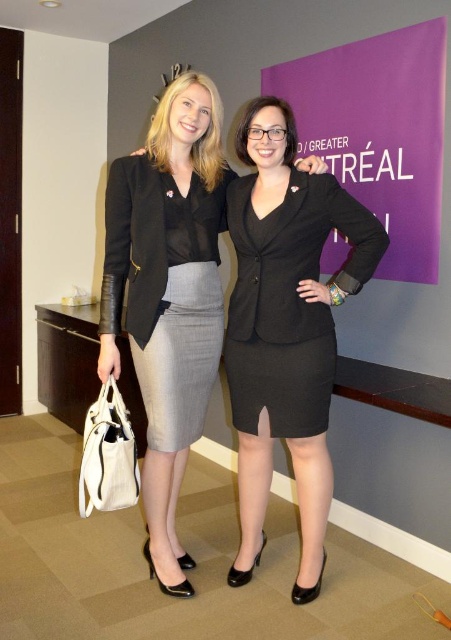
Where is `matte black blazer at center`? This screenshot has height=640, width=451. matte black blazer at center is located at coordinates (168, 292).

Can you confirm if matte black blazer at center is positioned below purple matte bulletin board at upper right?

Yes.

Locate an element on the screen. The image size is (451, 640). matte black blazer at center is located at coordinates (168, 292).

Can you confirm if purple matte bulletin board at upper right is positioned above gray textured skirt at center?

Indeed, purple matte bulletin board at upper right is positioned over gray textured skirt at center.

Which is above, purple matte bulletin board at upper right or gray textured skirt at center?

purple matte bulletin board at upper right is above.

The image size is (451, 640). Find the location of `purple matte bulletin board at upper right`. purple matte bulletin board at upper right is located at coordinates (378, 132).

Which is above, black matte dress at center or gray textured skirt at center?

gray textured skirt at center is above.

Is point (225, 362) positioned before point (127, 248)?

No, (225, 362) is further to viewer.

Does point (314, 192) come behind point (111, 228)?

No.

Locate an element on the screen. The height and width of the screenshot is (640, 451). black matte dress at center is located at coordinates (289, 300).